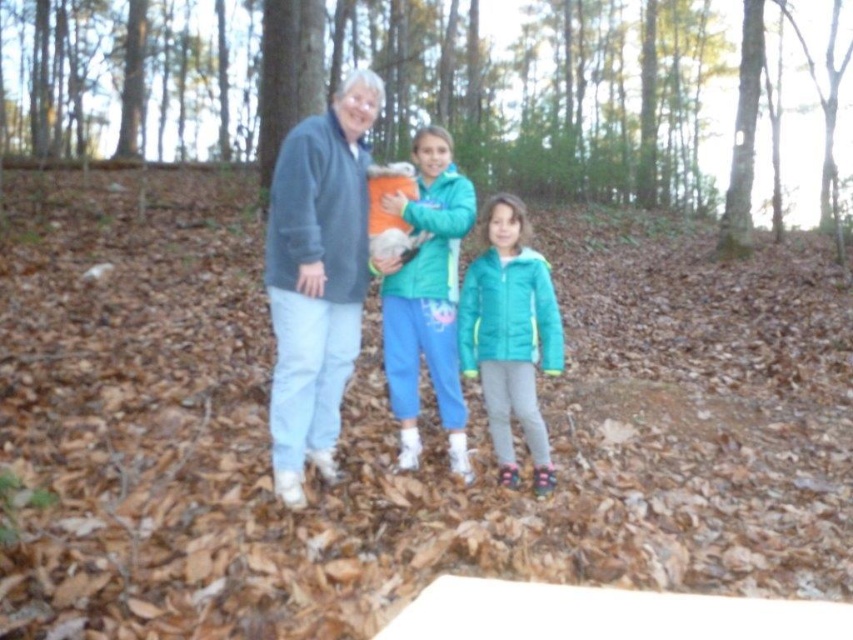
Between brown leaf litter at center and soft fleece jacket at center, which one appears on the right side from the viewer's perspective?

soft fleece jacket at center

Between point (576, 122) and point (350, 204), which one is positioned behind?

Positioned behind is point (576, 122).

The image size is (853, 640). Describe the element at coordinates (442, 90) in the screenshot. I see `brown leaf litter at center` at that location.

Find the location of a particular element. The height and width of the screenshot is (640, 853). brown leaf litter at center is located at coordinates (442, 90).

Is soft fleece jacket at center bigger than teal fleece jacket at center?

No, soft fleece jacket at center is not bigger than teal fleece jacket at center.

Does soft fleece jacket at center appear on the left side of teal fleece jacket at center?

Correct, you'll find soft fleece jacket at center to the left of teal fleece jacket at center.

Is point (291, 342) farther from viewer compared to point (439, 262)?

No, (291, 342) is in front of (439, 262).

You are a GUI agent. You are given a task and a screenshot of the screen. Output one action in this format:
    pyautogui.click(x=<x>, y=<y>)
    Task: Click on the soft fleece jacket at center
    Image resolution: width=853 pixels, height=640 pixels.
    Given the screenshot: What is the action you would take?
    pyautogui.click(x=317, y=276)

Does soft fleece jacket at center appear under teal quilted jacket at center?

Actually, soft fleece jacket at center is above teal quilted jacket at center.

Find the location of `soft fleece jacket at center`. soft fleece jacket at center is located at coordinates (317, 276).

Measure the distance between soft fleece jacket at center and camera.

soft fleece jacket at center and camera are 3.52 meters apart.

Identify the location of soft fleece jacket at center. (317, 276).